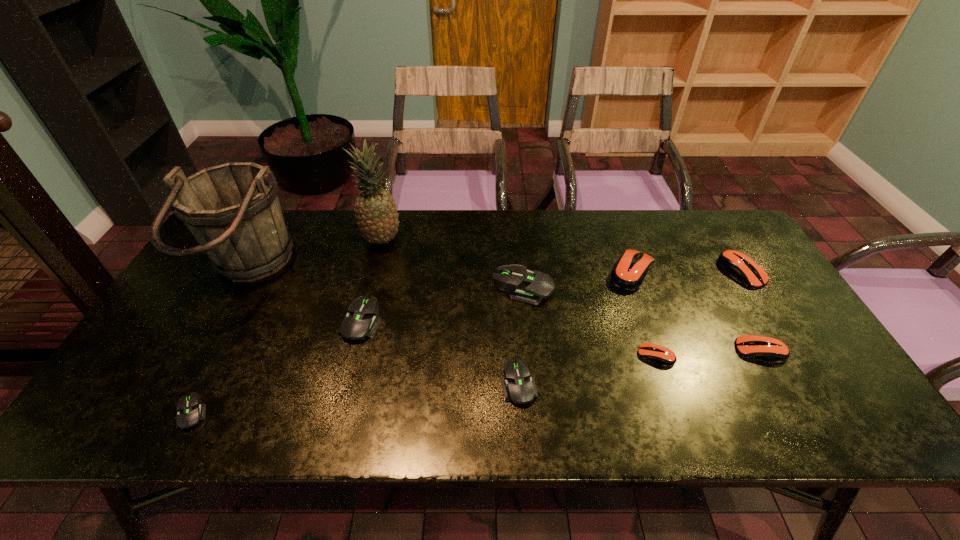
Where is `free space located on the front of the smallest orange computer mouse`? free space located on the front of the smallest orange computer mouse is located at coordinates (682, 429).

Locate an element on the screen. The width and height of the screenshot is (960, 540). free spot located 0.270m on the back of the smallest gray computer mouse is located at coordinates (247, 307).

Locate an element on the screen. This screenshot has height=540, width=960. pineapple present at the far edge is located at coordinates (375, 210).

Find the location of `bucket present at the far edge`. bucket present at the far edge is located at coordinates (233, 211).

The image size is (960, 540). Identify the location of object positioned at the left edge. (233, 211).

This screenshot has height=540, width=960. Find the location of `object that is at the far left corner`. object that is at the far left corner is located at coordinates (233, 211).

Identify the location of object that is at the far right corner. (736, 263).

The height and width of the screenshot is (540, 960). In order to click on vacant space at the far edge of the desktop in this screenshot , I will do [633, 211].

This screenshot has width=960, height=540. In the image, there is a desktop. In order to click on vacant area at the near edge in this screenshot , I will do `click(196, 430)`.

In the image, there is a desktop. Where is `vacant area at the left edge`? vacant area at the left edge is located at coordinates (183, 385).